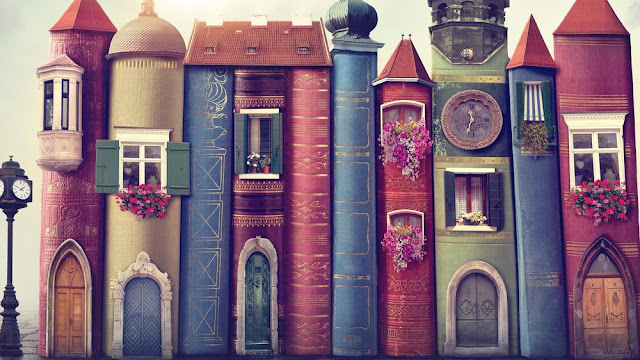
Image resolution: width=640 pixels, height=360 pixels. What are the coordinates of `wall clock` in the screenshot? It's located at 11,198.